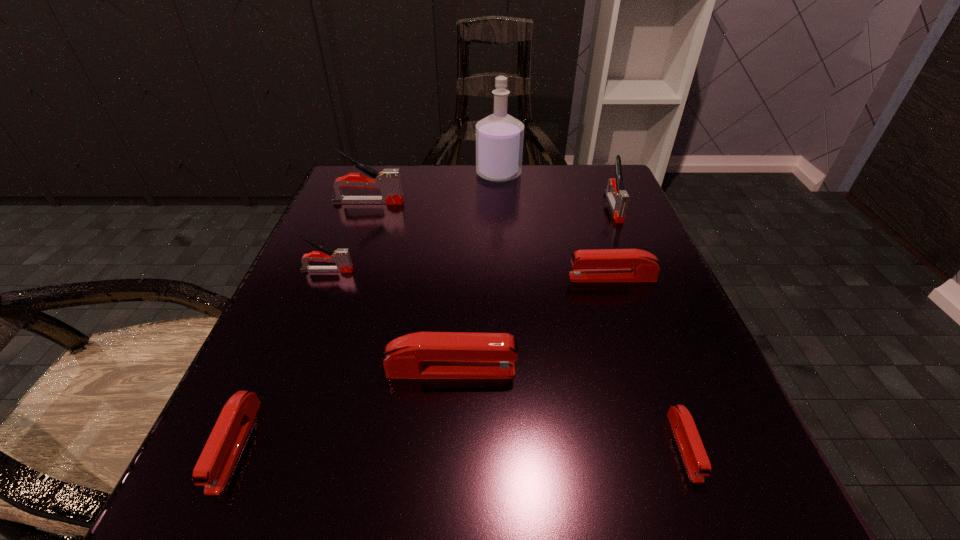
In the image, there is a desktop. Where is `vacant space at the left edge`? Image resolution: width=960 pixels, height=540 pixels. vacant space at the left edge is located at coordinates (390, 240).

This screenshot has width=960, height=540. What are the coordinates of `vacant area at the right edge` in the screenshot? It's located at (695, 387).

In the image, there is a desktop. Identify the location of vacant space at the near left corner. Image resolution: width=960 pixels, height=540 pixels. (323, 469).

Identify the location of vacant area at the far right corner of the desktop. (588, 166).

Identify the location of free space at the near right corner of the desktop. (645, 480).

Identify the location of empty location between the second smallest gray stapler and the smallest red stapler. (649, 326).

In order to click on vacant space that is in between the biggest gray stapler and the shortest stapler in this screenshot , I will do `click(526, 324)`.

This screenshot has width=960, height=540. I want to click on vacant area that lies between the fifth tallest stapler and the biggest gray stapler, so click(x=491, y=240).

Identify the location of free area in between the seventh tallest object and the smallest red stapler. The image size is (960, 540). (460, 445).

Find the location of a particular element. This screenshot has height=540, width=960. vacant space in between the third smallest red stapler and the second red stapler from left to right is located at coordinates (532, 324).